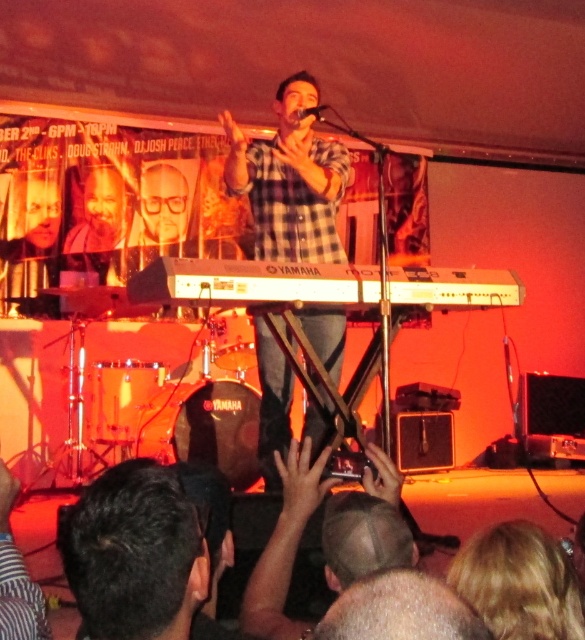
Question: Can you confirm if checkered fabric shirt at center is wider than white plastic keyboard at center?

Choices:
 (A) yes
 (B) no

Answer: (B)

Question: Among these objects, which one is nearest to the camera?

Choices:
 (A) white plastic keyboard at center
 (B) checkered fabric shirt at center
 (C) metallic silver microphone at center

Answer: (A)

Question: Which object is positioned farthest from the checkered fabric shirt at center?

Choices:
 (A) smooth skin head at center
 (B) white plastic keyboard at center
 (C) metallic silver microphone at center

Answer: (A)

Question: Is white plastic keyboard at center in front of metallic silver microphone at center?

Choices:
 (A) yes
 (B) no

Answer: (A)

Question: Does checkered fabric shirt at center have a lesser width compared to white plastic keyboard at center?

Choices:
 (A) yes
 (B) no

Answer: (A)

Question: Which object is closer to the camera taking this photo?

Choices:
 (A) smooth skin head at center
 (B) white plastic keyboard at center

Answer: (A)